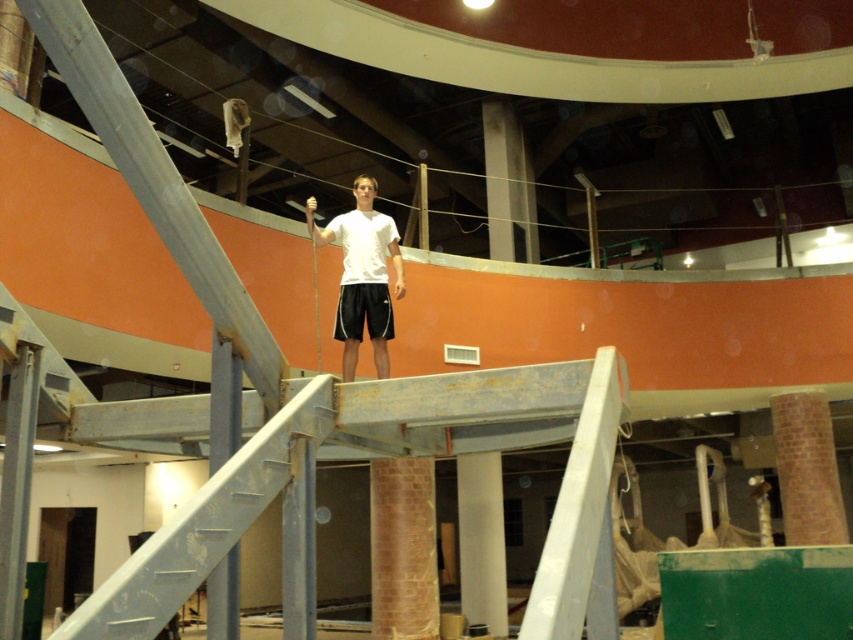
You are an inspector checking the construction site. You notice the white glossy column at center and the black cotton shorts at center. Which object is located to the right of the other?

The white glossy column at center is positioned on the right side of black cotton shorts at center, so the white glossy column at center is to the right of the black cotton shorts at center.

You are a construction worker standing at the camera position. You need to reach point (x=347, y=218) to secure a loose beam. If your safety harness has a maximum extension of 20 feet, will you be able to reach the point?

Result: The distance between point (x=347, y=218) and the camera is 19.95 feet, which is within the safety harness maximum extension of 20 feet. Therefore, you can safely reach the point.

You are a construction worker standing in the middle of an unfinished room. You need to move a heavy tool from the white glossy column at center to the black cotton shorts at center. Which object should you move the tool closer to first?

The white glossy column at center is closer to you than the black cotton shorts at center, so you should move the tool closer to the white glossy column at center first.